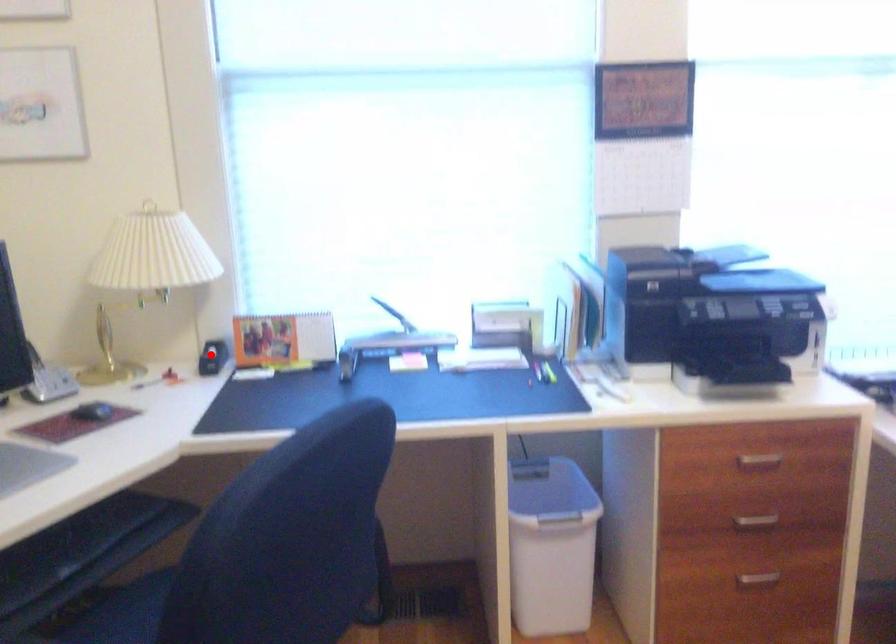
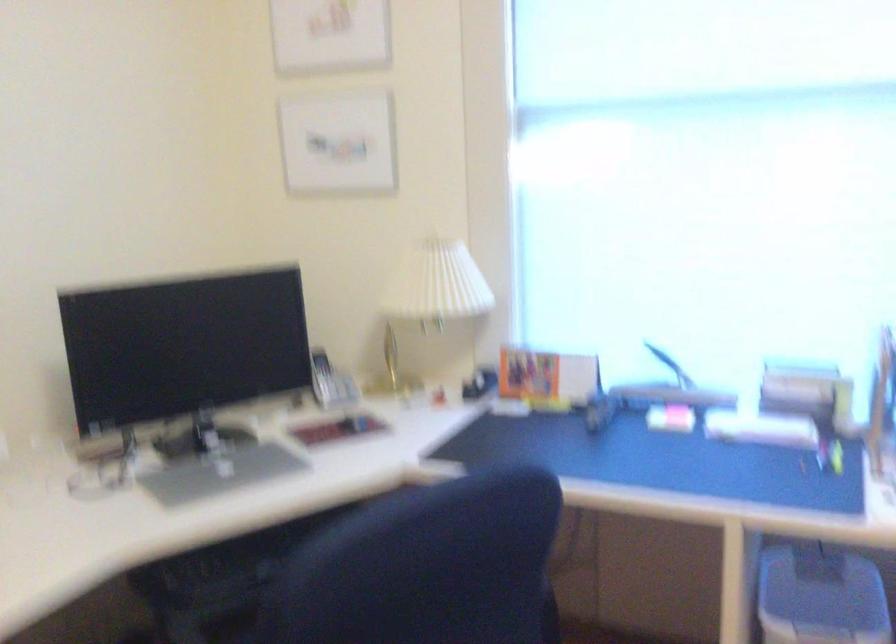
In the second image, find the point that corresponds to the highlighted location in the first image.

(479, 383)